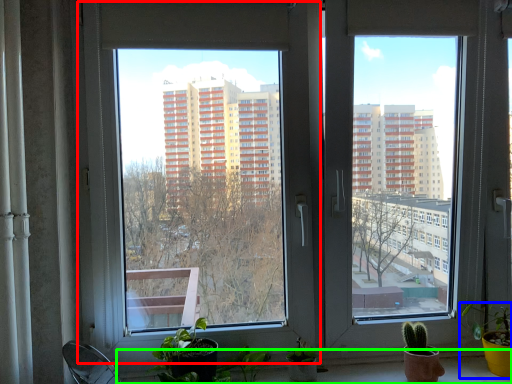
Question: Which is nearer to the window (highlighted by a red box)? houseplant (highlighted by a blue box) or window sill (highlighted by a green box).

Choices:
 (A) houseplant
 (B) window sill

Answer: (B)